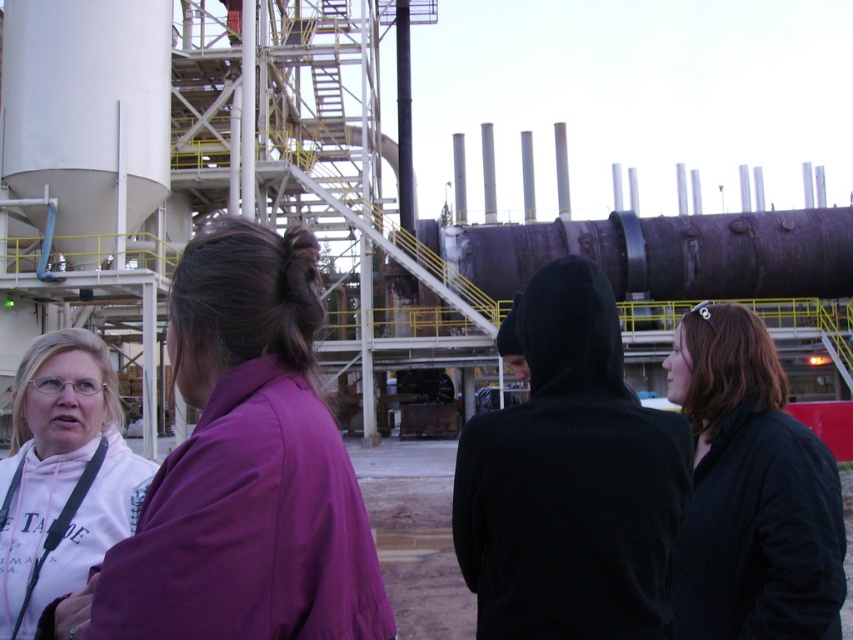
Question: Considering the real-world distances, which object is closest to the purple fabric shirt at left?

Choices:
 (A) black matte jacket at lower right
 (B) white cotton hoodie at lower left

Answer: (B)

Question: Does purple fabric shirt at left lie in front of white cotton hoodie at lower left?

Choices:
 (A) no
 (B) yes

Answer: (B)

Question: Among these objects, which one is farthest from the camera?

Choices:
 (A) purple fabric shirt at left
 (B) white cotton hoodie at lower left

Answer: (B)

Question: Among these points, which one is farthest from the camera?

Choices:
 (A) (187, 304)
 (B) (752, 620)

Answer: (B)

Question: From the image, what is the correct spatial relationship of purple fabric shirt at left in relation to white cotton hoodie at lower left?

Choices:
 (A) right
 (B) left

Answer: (A)

Question: Where is purple fabric shirt at left located in relation to white cotton hoodie at lower left in the image?

Choices:
 (A) left
 (B) right

Answer: (B)